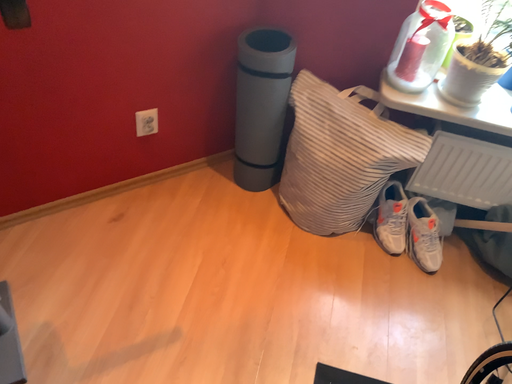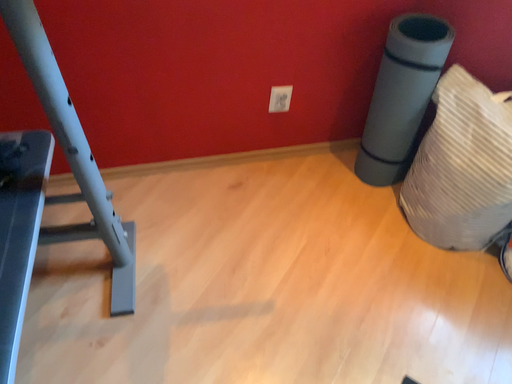
Question: How did the camera likely rotate when shooting the video?

Choices:
 (A) rotated right
 (B) rotated left

Answer: (B)